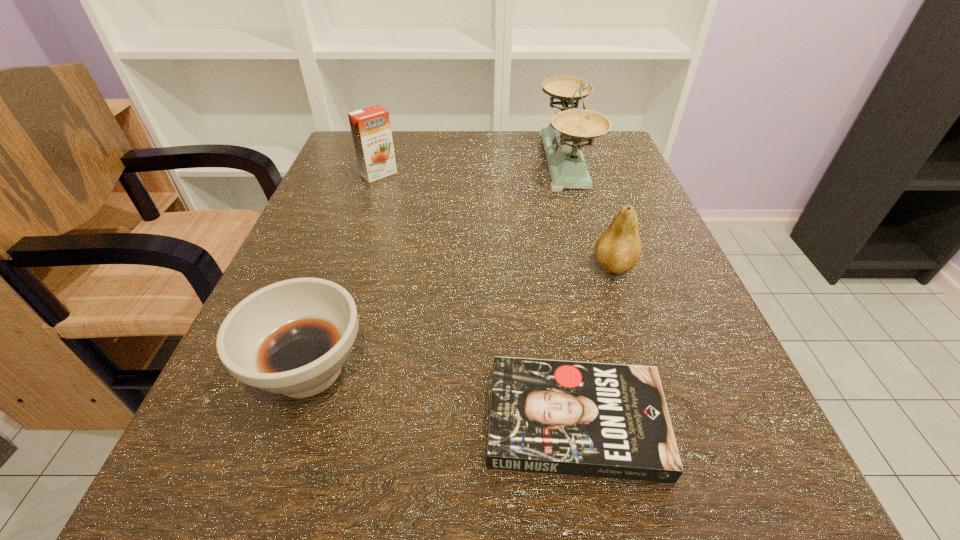
Locate an element on the screen. The width and height of the screenshot is (960, 540). object located in the far left corner section of the desktop is located at coordinates (371, 130).

At what (x,y) coordinates should I click in order to perform the action: click on object that is at the far right corner. Please return your answer as a coordinate pair (x, y). The image size is (960, 540). Looking at the image, I should click on (562, 139).

The height and width of the screenshot is (540, 960). I want to click on object situated at the near right corner, so click(605, 420).

What are the coordinates of `vacant region at the far edge of the desktop` in the screenshot? It's located at (414, 174).

You are a GUI agent. You are given a task and a screenshot of the screen. Output one action in this format:
    pyautogui.click(x=<x>, y=<y>)
    Task: Click on the blank area at the near edge
    
    Given the screenshot: What is the action you would take?
    pyautogui.click(x=496, y=489)

You are a GUI agent. You are given a task and a screenshot of the screen. Output one action in this format:
    pyautogui.click(x=<x>, y=<y>)
    Task: Click on the free space at the left edge of the desktop
    The width and height of the screenshot is (960, 540).
    Given the screenshot: What is the action you would take?
    pyautogui.click(x=335, y=231)

Identify the location of vacant space at the right edge of the desktop. (653, 231).

The width and height of the screenshot is (960, 540). In the image, there is a desktop. Identify the location of vacant space at the far right corner. (589, 160).

The width and height of the screenshot is (960, 540). In order to click on empty space that is in between the second shortest object and the third farthest object in this screenshot , I will do 461,318.

The image size is (960, 540). I want to click on vacant space that is in between the soup bowl and the tallest object, so [x=437, y=265].